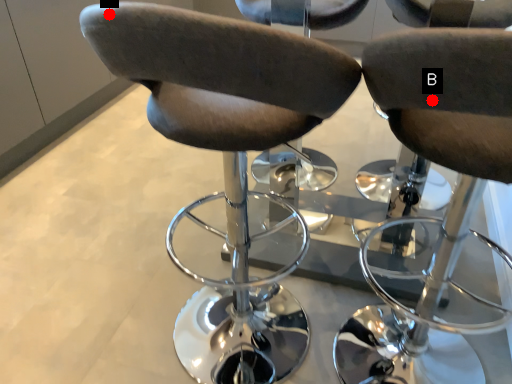
Question: Two points are circled on the image, labeled by A and B beside each circle. Which point appears farthest from the camera in this image?

Choices:
 (A) A is further
 (B) B is further

Answer: (B)